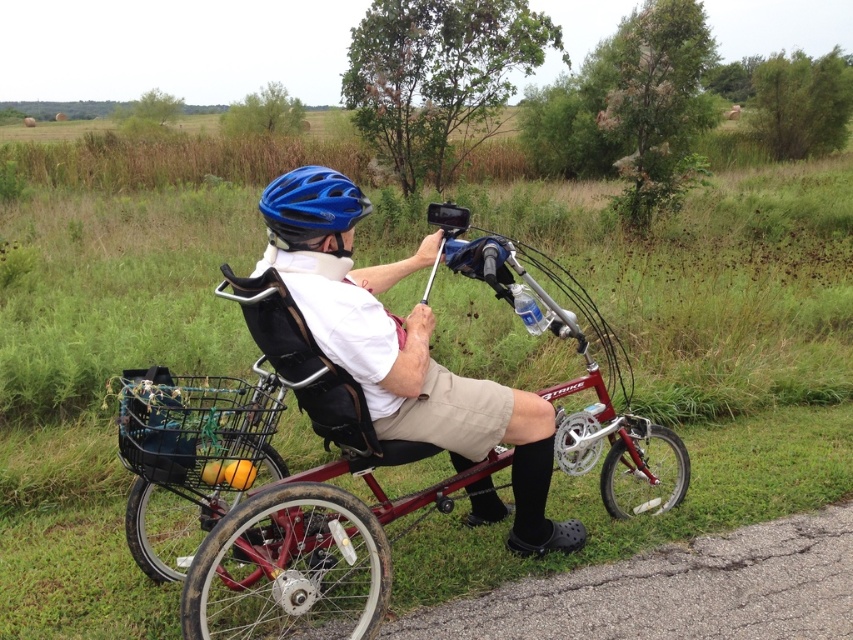
Question: Which point is closer to the camera taking this photo?

Choices:
 (A) (260, 420)
 (B) (314, 545)

Answer: (B)

Question: Is metallic red tricycle at center above blue matte helmet at upper center?

Choices:
 (A) yes
 (B) no

Answer: (B)

Question: Among these points, which one is farthest from the camera?

Choices:
 (A) (125, 396)
 (B) (326, 211)
 (C) (352, 572)

Answer: (C)

Question: Which point is closer to the camera?

Choices:
 (A) metallic red tricycle at center
 (B) black mesh basket at lower left
 (C) blue matte helmet at upper center

Answer: (A)

Question: Does metallic red tricycle at center have a lesser width compared to blue matte helmet at upper center?

Choices:
 (A) no
 (B) yes

Answer: (A)

Question: Where is metallic red tricycle at center located in relation to blue matte helmet at upper center in the image?

Choices:
 (A) below
 (B) above

Answer: (A)